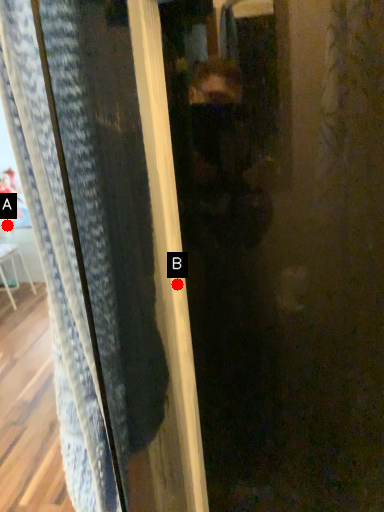
Question: Two points are circled on the image, labeled by A and B beside each circle. Which point is closer to the camera?

Choices:
 (A) A is closer
 (B) B is closer

Answer: (B)